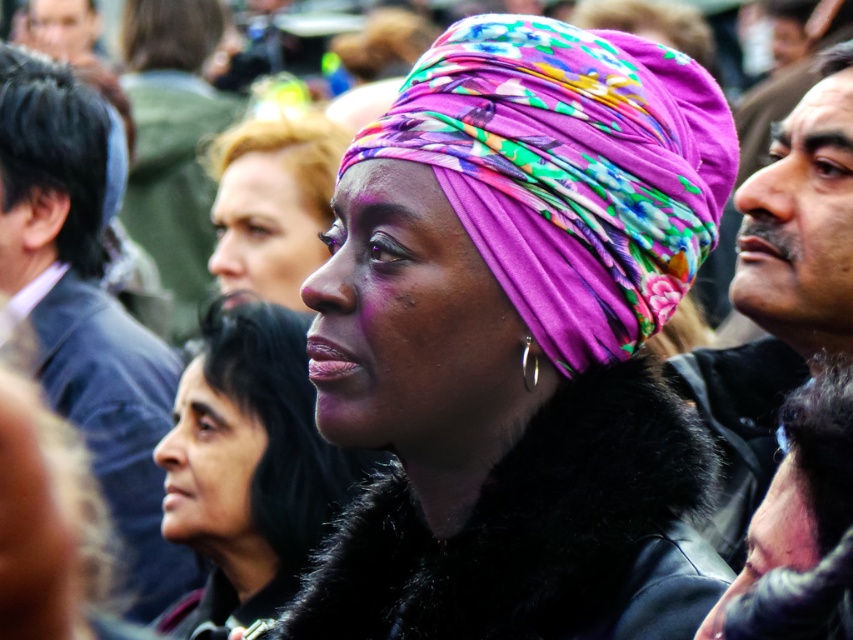
Question: Does matte black fur coat at center appear on the right side of matte black hair at upper center?

Choices:
 (A) no
 (B) yes

Answer: (B)

Question: Among these objects, which one is nearest to the camera?

Choices:
 (A) matte black fur coat at center
 (B) blonde hair at upper left
 (C) smooth skin face at lower left
 (D) smooth skin face at right

Answer: (D)

Question: Can you confirm if purple floral headscarf at center is positioned to the left of smooth skin face at right?

Choices:
 (A) yes
 (B) no

Answer: (A)

Question: Which object appears farthest from the camera in this image?

Choices:
 (A) matte black fur coat at center
 (B) smooth skin face at lower left

Answer: (B)

Question: Based on their relative distances, which object is farther from the black hair at left?

Choices:
 (A) smooth skin face at right
 (B) matte black fur coat at center
 (C) dark brown suit at left

Answer: (A)

Question: Is matte black hair at upper center closer to the viewer compared to blonde hair at upper left?

Choices:
 (A) yes
 (B) no

Answer: (A)